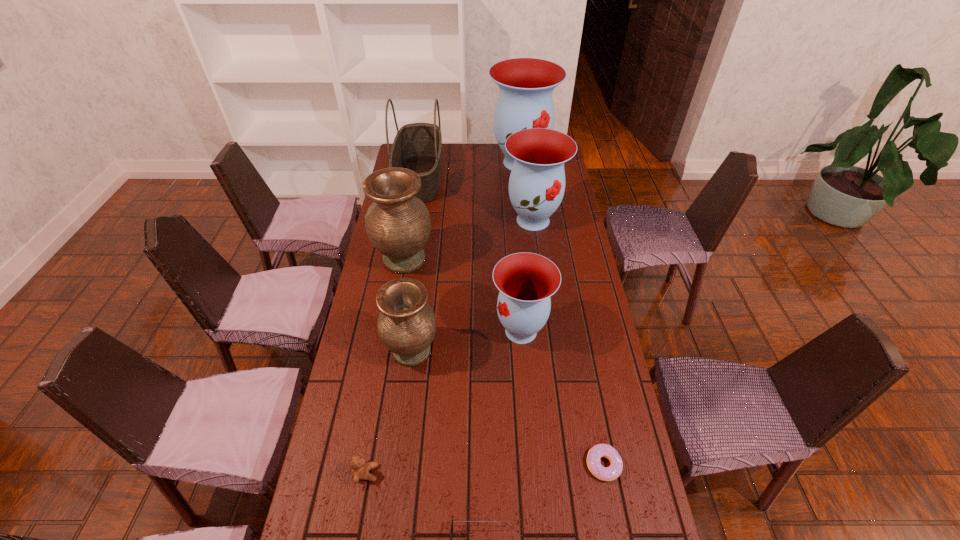
Locate an element on the screen. the farthest red vase is located at coordinates (526, 85).

Locate an element on the screen. the farthest vase is located at coordinates (526, 85).

The image size is (960, 540). I want to click on basket, so click(418, 146).

Identify the location of the second smallest red vase. (537, 181).

The height and width of the screenshot is (540, 960). Identify the location of the bigger green vase. coord(398,224).

The image size is (960, 540). Identify the location of the smallest red vase. (526, 281).

You are a GUI agent. You are given a task and a screenshot of the screen. Output one action in this format:
    pyautogui.click(x=<x>, y=<y>)
    Task: Click on the smaller green vase
    
    Given the screenshot: What is the action you would take?
    pyautogui.click(x=406, y=325)

What are the coordinates of `brown teddy bear` in the screenshot? It's located at (360, 468).

Locate an element on the screen. the third shortest object is located at coordinates (360, 468).

The width and height of the screenshot is (960, 540). I want to click on pink doughnut, so click(610, 473).